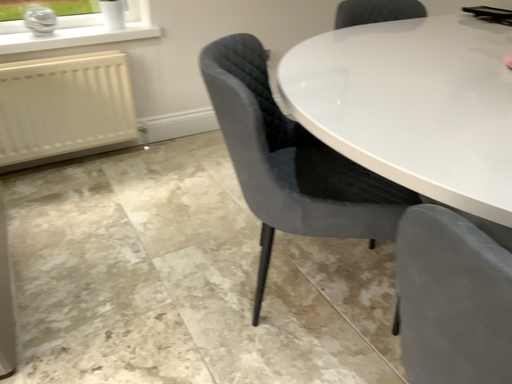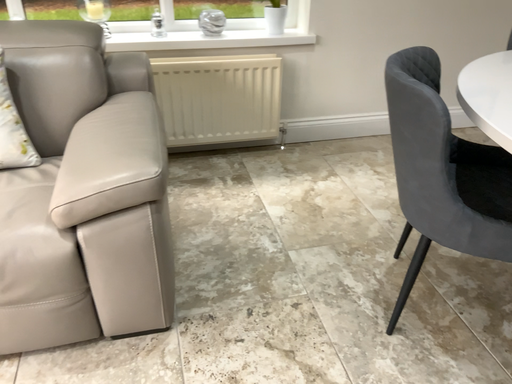
Question: How did the camera likely rotate when shooting the video?

Choices:
 (A) rotated left
 (B) rotated right

Answer: (A)